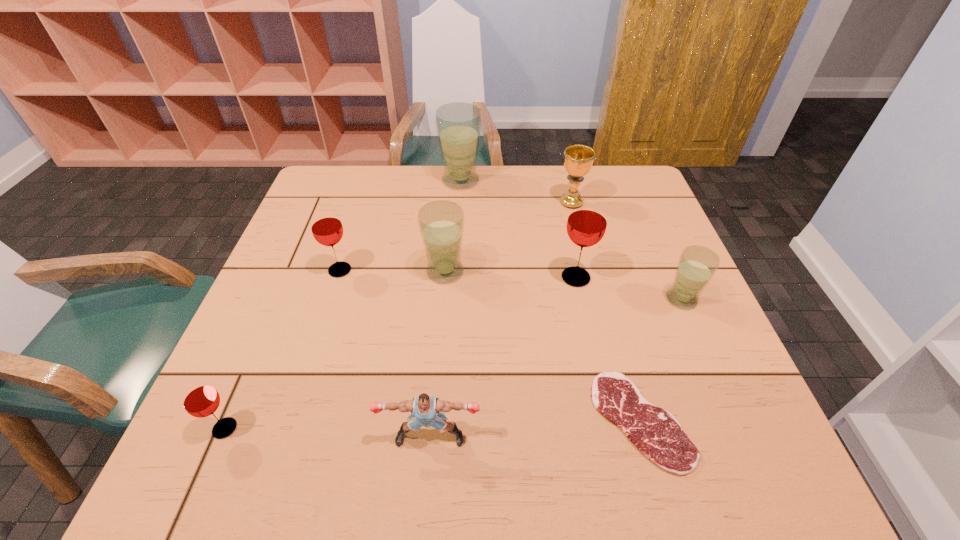
What are the coordinates of `steak that is positioned at the right edge` in the screenshot? It's located at (654, 431).

The image size is (960, 540). Identify the location of object located in the near left corner section of the desktop. (200, 399).

Image resolution: width=960 pixels, height=540 pixels. Find the location of `object that is positioned at the near right corner`. object that is positioned at the near right corner is located at coordinates (654, 431).

Where is `vacant region at the far edge of the desktop`? The width and height of the screenshot is (960, 540). vacant region at the far edge of the desktop is located at coordinates (437, 166).

In the image, there is a desktop. Where is `free space at the left edge`? The height and width of the screenshot is (540, 960). free space at the left edge is located at coordinates (273, 282).

In the image, there is a desktop. Identify the location of vacant area at the right edge. The height and width of the screenshot is (540, 960). pos(669,301).

At what (x,y) coordinates should I click in order to perform the action: click on vacant space at the near left corner of the desktop. Please return your answer as a coordinate pair (x, y). Image resolution: width=960 pixels, height=540 pixels. Looking at the image, I should click on (246, 438).

Find the location of a particular element. This screenshot has height=540, width=960. free space between the second farthest object and the steak is located at coordinates (606, 312).

Where is `vacant space that is in between the second farthest blue glass and the shortest object`? vacant space that is in between the second farthest blue glass and the shortest object is located at coordinates (542, 346).

The width and height of the screenshot is (960, 540). In order to click on free space between the biggest blue glass and the gold chalice in this screenshot , I will do `click(516, 192)`.